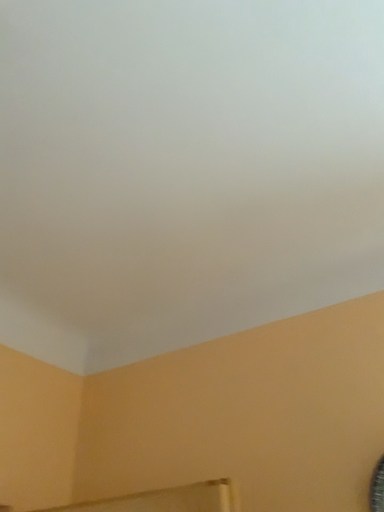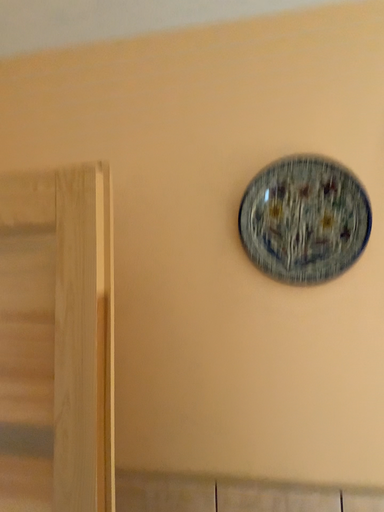
Question: Which way did the camera rotate in the video?

Choices:
 (A) rotated right
 (B) rotated left

Answer: (A)